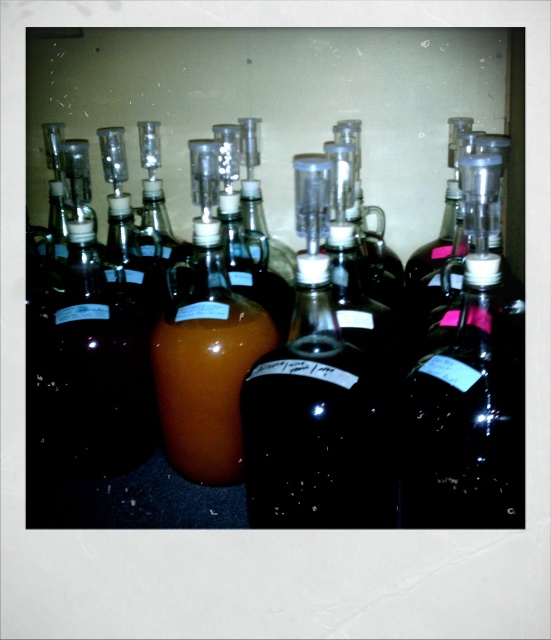
Question: Does translucent glass bottle at center have a smaller size compared to translucent amber liquid at center?

Choices:
 (A) yes
 (B) no

Answer: (B)

Question: Which object is closer to the camera taking this photo?

Choices:
 (A) translucent glass bottle at center
 (B) translucent amber liquid at center

Answer: (A)

Question: Which object is closer to the camera taking this photo?

Choices:
 (A) translucent amber liquid at center
 (B) translucent glass bottle at center

Answer: (B)

Question: Is translucent glass bottle at center thinner than translucent amber liquid at center?

Choices:
 (A) no
 (B) yes

Answer: (A)

Question: Can you confirm if translucent glass bottle at center is positioned to the left of translucent amber liquid at center?

Choices:
 (A) yes
 (B) no

Answer: (B)

Question: Which object is farther from the camera taking this photo?

Choices:
 (A) translucent glass bottle at center
 (B) translucent amber liquid at center

Answer: (B)